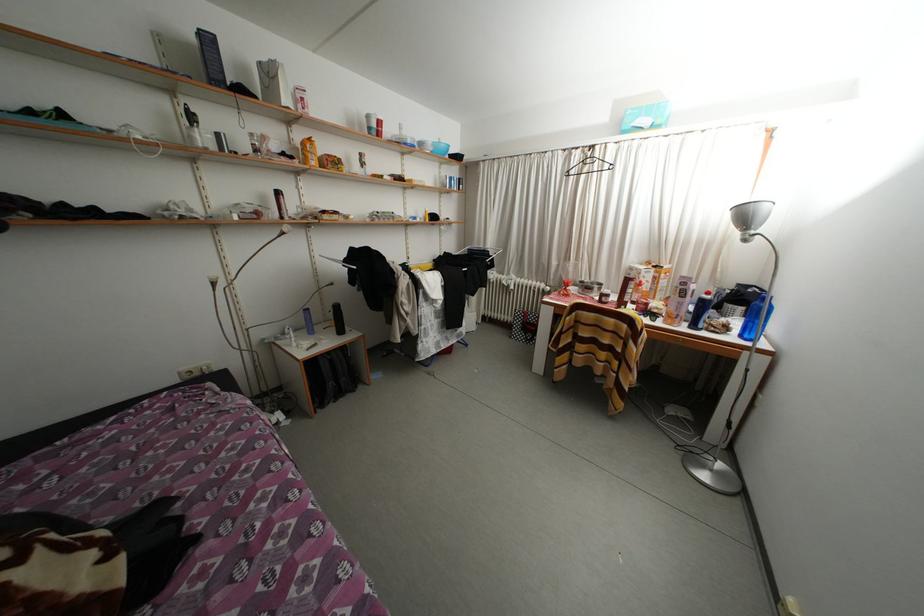
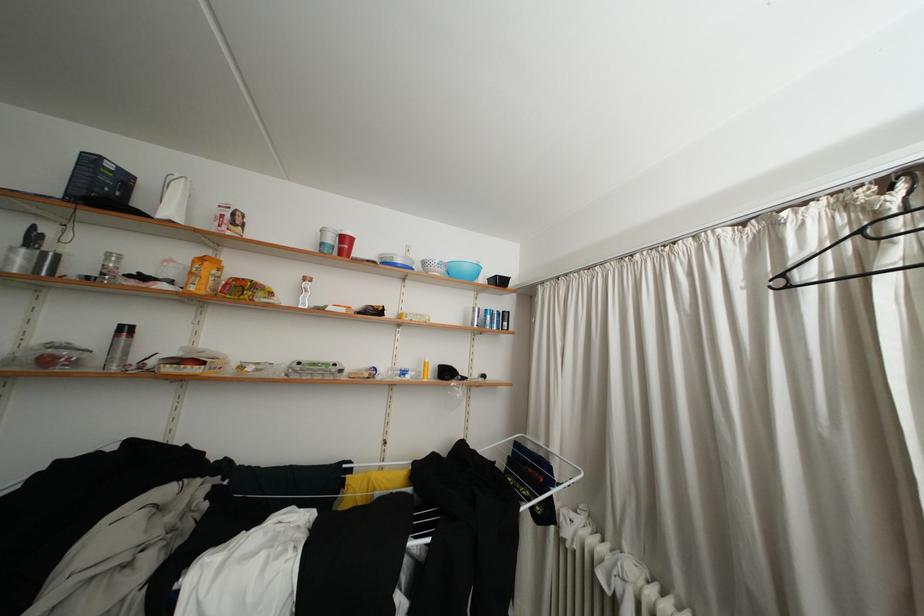
The point at (490, 252) is marked in the first image. Where is the corresponding point in the second image?

(550, 448)